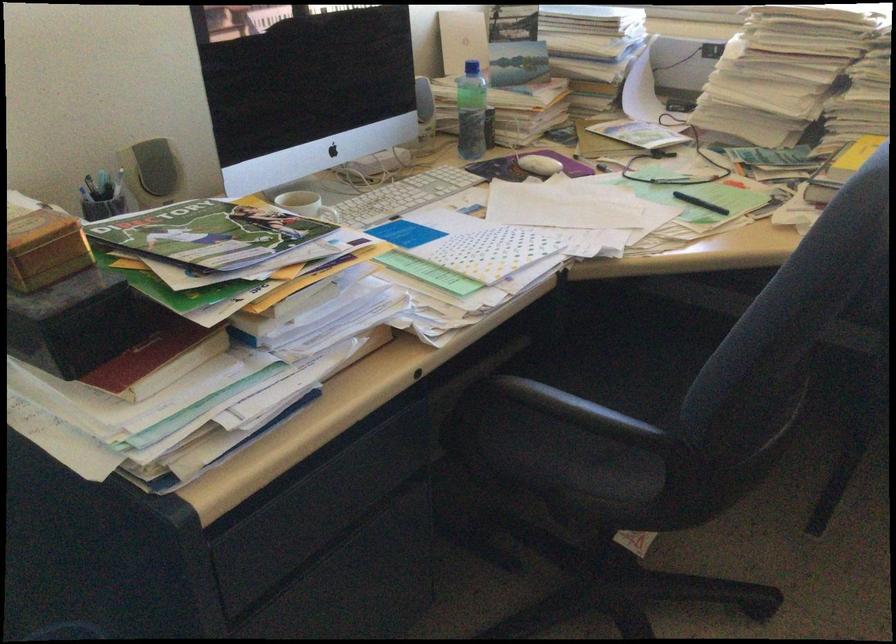
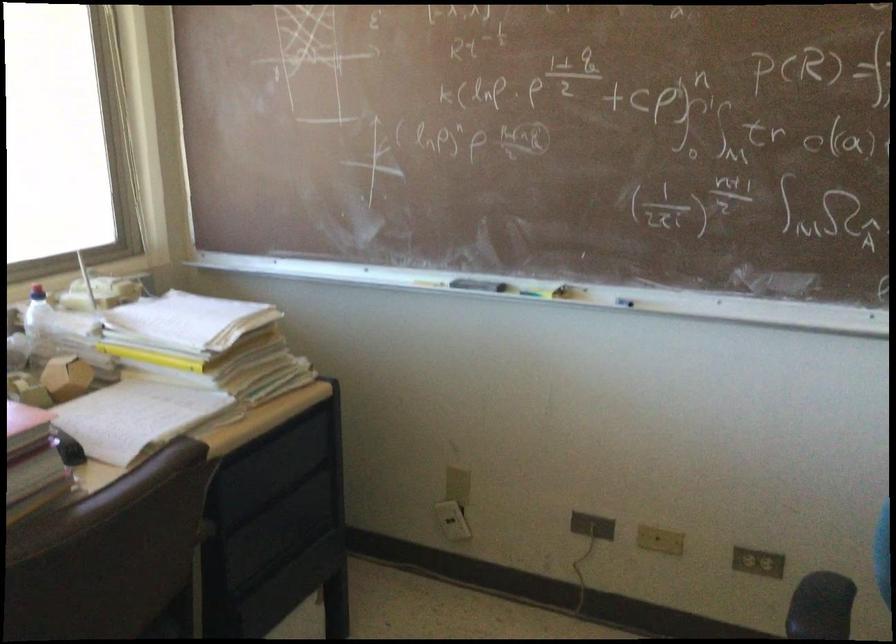
The first image is from the beginning of the video and the second image is from the end. How did the camera likely rotate when shooting the video?

The camera's rotation is toward right-down.